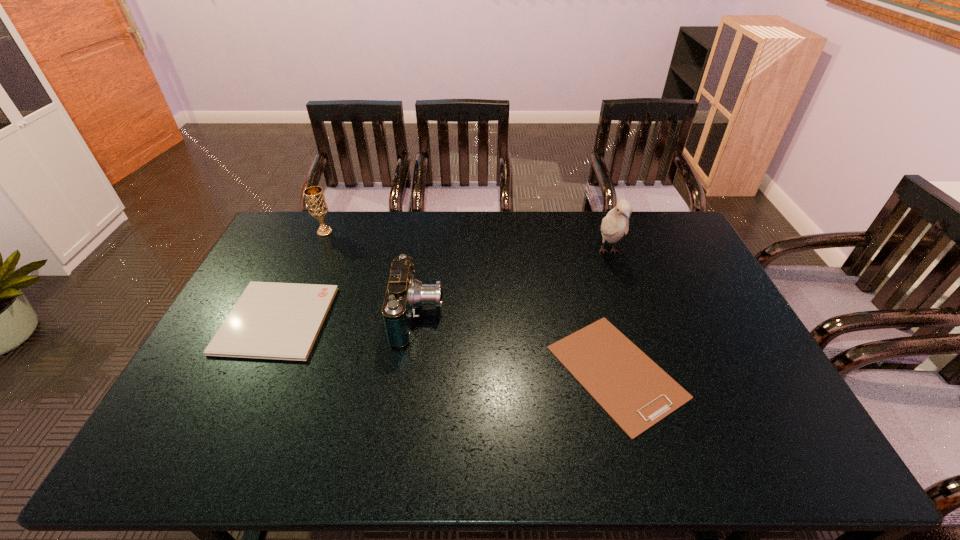
The image size is (960, 540). In order to click on free space located on the front-facing side of the third shortest object in this screenshot , I will do `click(513, 316)`.

What are the coordinates of `free space located on the back of the fourth tallest object` in the screenshot? It's located at (300, 271).

I want to click on vacant space located on the back of the shorter clipboard, so click(x=580, y=240).

What are the coordinates of `bird located at the far edge` in the screenshot? It's located at (616, 223).

The height and width of the screenshot is (540, 960). Identify the location of chalice present at the far edge. (317, 206).

The width and height of the screenshot is (960, 540). I want to click on object that is at the near edge, so click(x=636, y=393).

Find the location of a particular element. The height and width of the screenshot is (540, 960). chalice located at the left edge is located at coordinates (317, 206).

The height and width of the screenshot is (540, 960). In order to click on clipboard present at the left edge in this screenshot , I will do `click(270, 320)`.

In order to click on object at the far left corner in this screenshot , I will do `click(317, 206)`.

In the image, there is a desktop. Where is `free region at the far edge`? free region at the far edge is located at coordinates (521, 230).